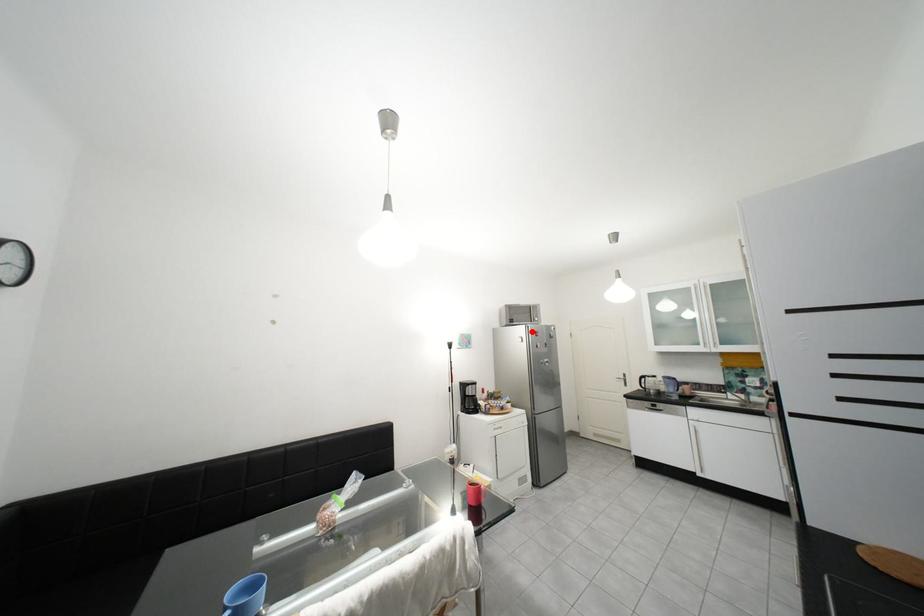
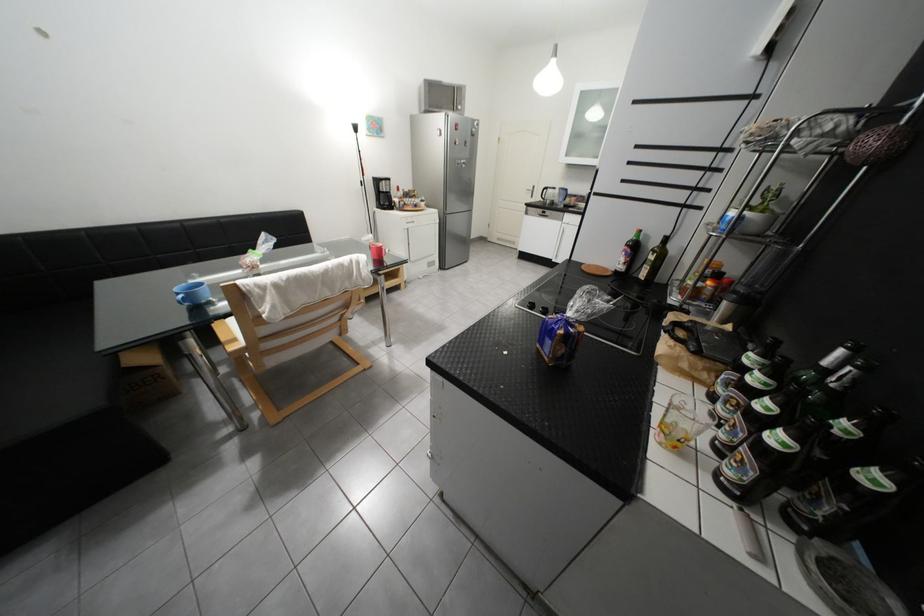
Question: I am providing you with two images of the same scene from different viewpoints. Image1 has a red point marked. In image2, the corresponding 3D location appears at what relative position? Reply with the corresponding letter.

Choices:
 (A) Closer
 (B) Farther

Answer: (A)